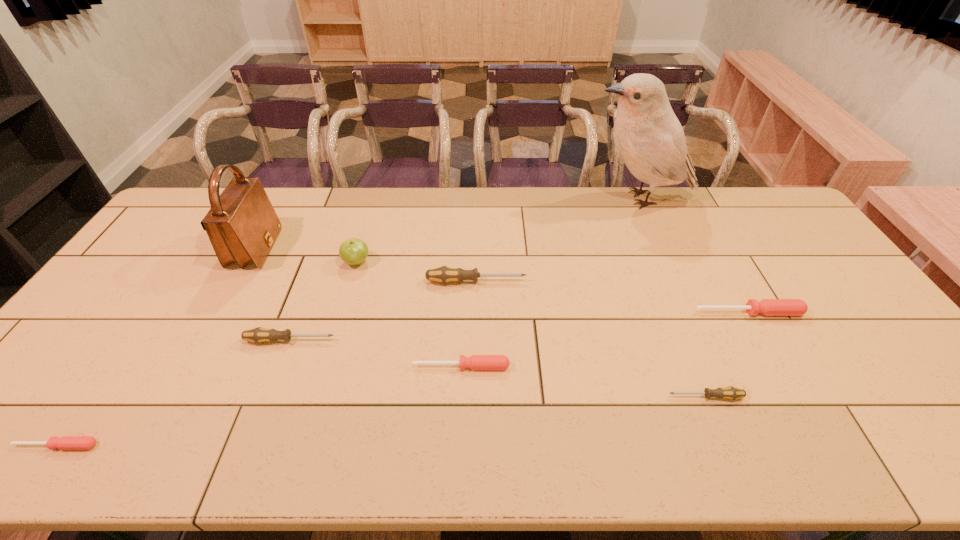
This screenshot has width=960, height=540. In order to click on the fifth farthest object in this screenshot , I will do `click(768, 307)`.

What are the coordinates of `the farthest red screwdriver` in the screenshot? It's located at (768, 307).

Identify the location of the second smallest red screwdriver. The width and height of the screenshot is (960, 540). (476, 362).

At what (x,y) coordinates should I click in order to perform the action: click on the third nearest screwdriver. Please return your answer as a coordinate pair (x, y). The image size is (960, 540). Looking at the image, I should click on (476, 362).

You are a GUI agent. You are given a task and a screenshot of the screen. Output one action in this format:
    pyautogui.click(x=<x>, y=<y>)
    Task: Click on the smallest gray screwdriver
    This screenshot has width=960, height=540.
    Given the screenshot: What is the action you would take?
    pyautogui.click(x=732, y=393)

The image size is (960, 540). Identify the location of the nearest gray screwdriver. (732, 393).

Identify the location of the nearest red screwdriver. This screenshot has height=540, width=960. (66, 442).

The height and width of the screenshot is (540, 960). I want to click on the shortest screwdriver, so 66,442.

You are a GUI agent. You are given a task and a screenshot of the screen. Output one action in this format:
    pyautogui.click(x=<x>, y=<y>)
    Task: Click on the vacant position located on the face of the tallest object
    This screenshot has width=960, height=540.
    Given the screenshot: What is the action you would take?
    pyautogui.click(x=505, y=198)

Where is `vacant space located on the face of the tallest object`? This screenshot has width=960, height=540. vacant space located on the face of the tallest object is located at coordinates (516, 198).